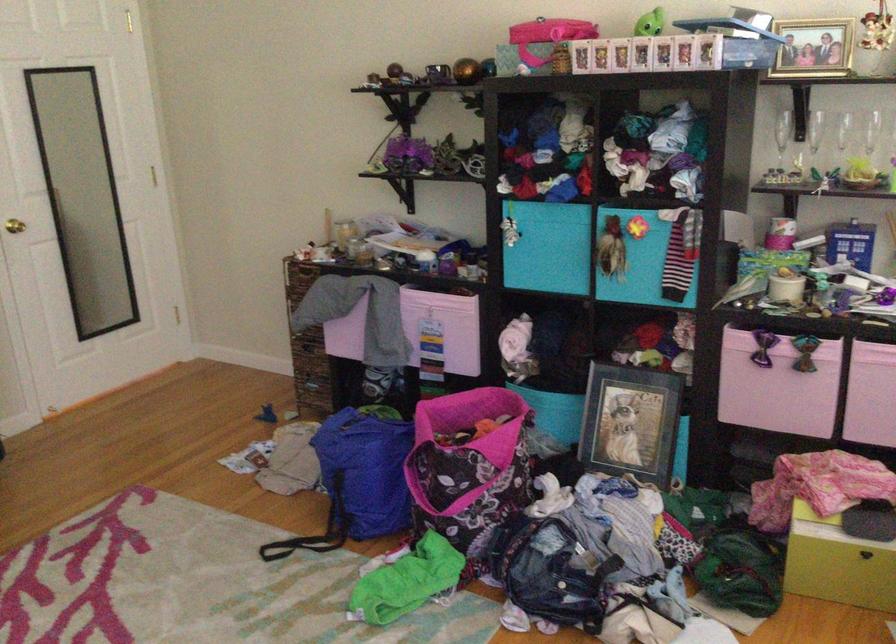
The height and width of the screenshot is (644, 896). Describe the element at coordinates (288, 547) in the screenshot. I see `the black bag strap` at that location.